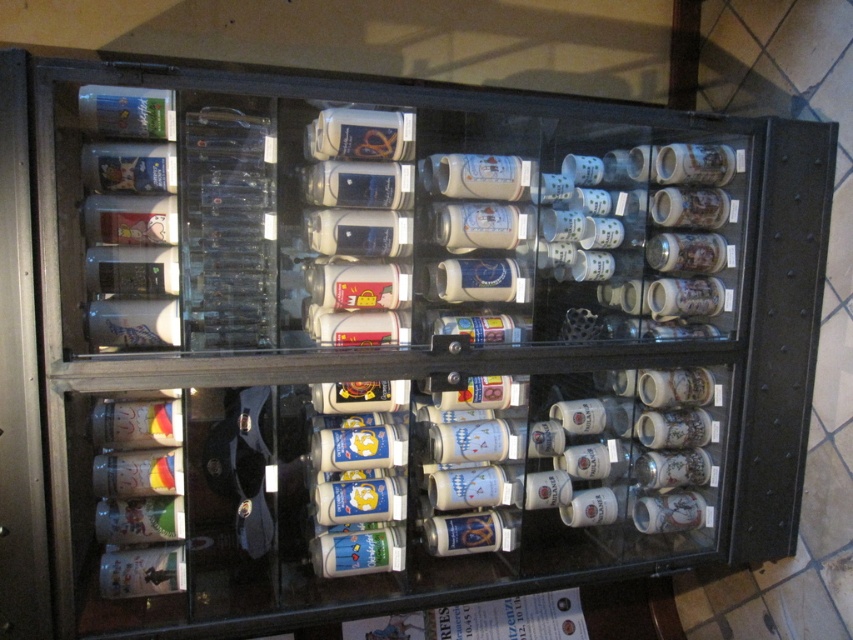
You are standing in front of the display case and want to reach both the point at (500,196) and the point at (86,163). Which point should you reach for first if you want to touch them in the order they appear from closest to farthest?

You should reach for point (86,163) first because it is closer to you than point (500,196), which is behind it.

You are a customer at the bar and want to choose a drink container. You see the white glossy mug at center and the matte plastic bottle at upper left. Which one is taller?

The white glossy mug at center is taller than the matte plastic bottle at upper left.